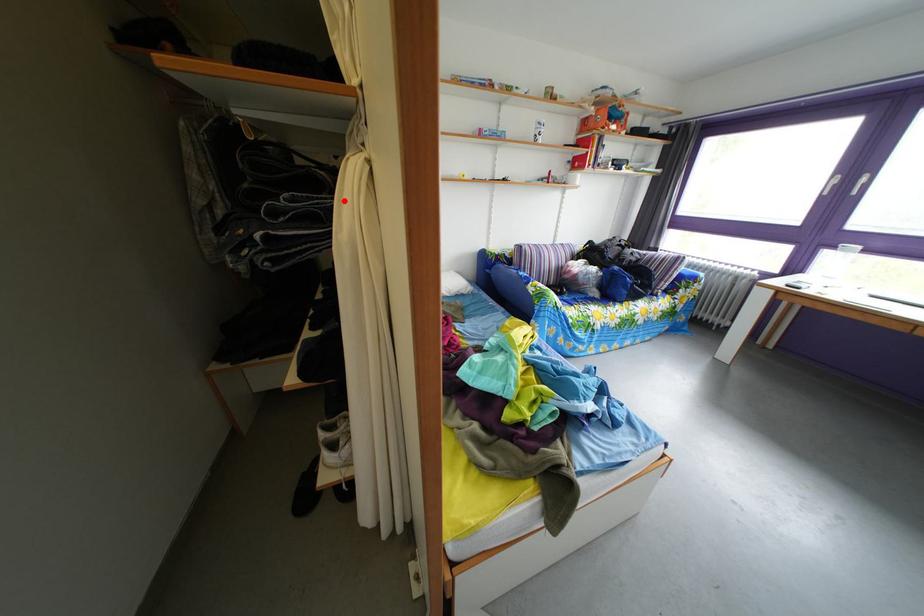
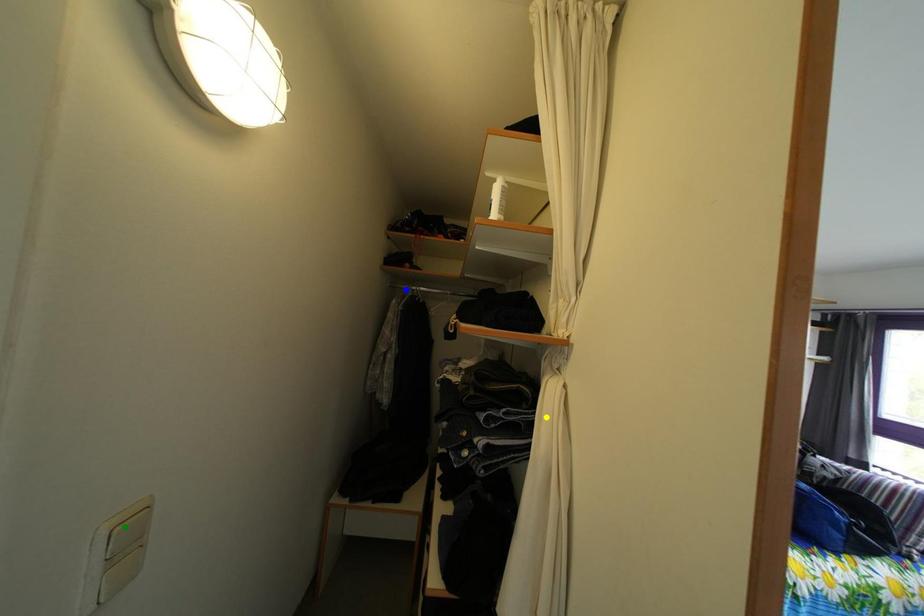
Question: I am providing you with two images of the same scene from different viewpoints. A red point is marked on the first image. You are given multiple points on the second image. Which point in image 2 represents the same 3d spot as the red point in image 1?

Choices:
 (A) blue point
 (B) yellow point
 (C) green point

Answer: (B)